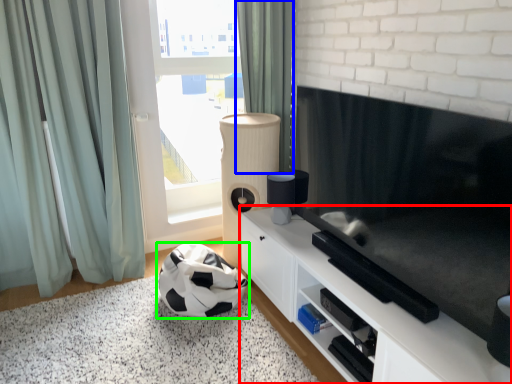
Question: Estimate the real-world distances between objects in this image. Which object is farther from cabinetry (highlighted by a red box), curtain (highlighted by a blue box) or football (highlighted by a green box)?

Choices:
 (A) curtain
 (B) football

Answer: (A)